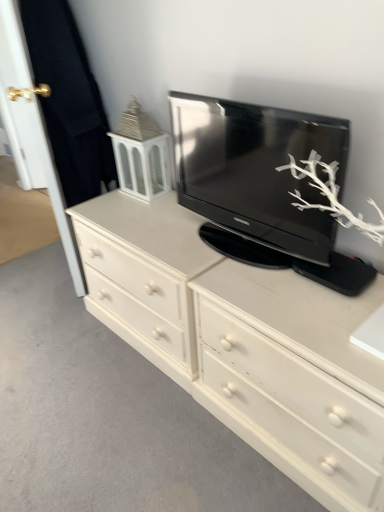
Where is `vacant space to the left of white painted wood tv cabinet at upper left`? This screenshot has height=512, width=384. vacant space to the left of white painted wood tv cabinet at upper left is located at coordinates (107, 202).